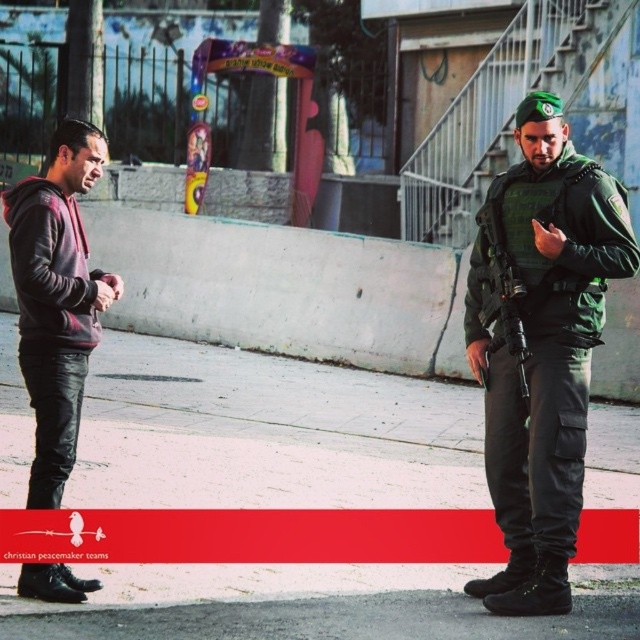
You are a photographer trying to capture both the green matte uniform at right and the matte black hoodie at left in the same frame. Based on their sizes, which one should you focus on to ensure both are visible clearly?

Since the green matte uniform at right is larger in size than the matte black hoodie at left, you should focus on the green matte uniform at right to ensure both are visible clearly.

You are a delivery person trying to determine the best path to approach the two individuals in the scene. The person in the matte black hoodie at left is holding a phone, and the person in the matte black rifle at right is holding a firearm. Based on their positions, which individual should you approach first to avoid any potential conflict?

The matte black hoodie at left is below the matte black rifle at right, so approaching the person in the matte black hoodie at left first would be safer as they are positioned lower and not holding a visible threat compared to the rifle.